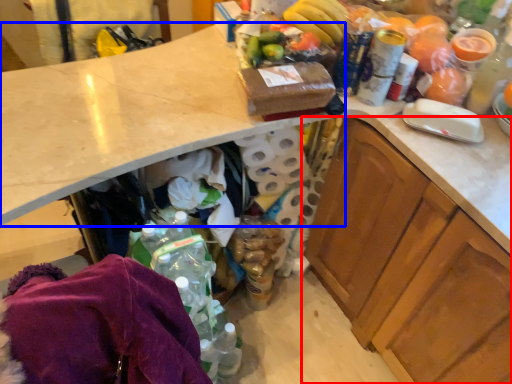
Question: Among these objects, which one is nearest to the camera, cabinetry (highlighted by a red box) or countertop (highlighted by a blue box)?

Choices:
 (A) cabinetry
 (B) countertop

Answer: (A)